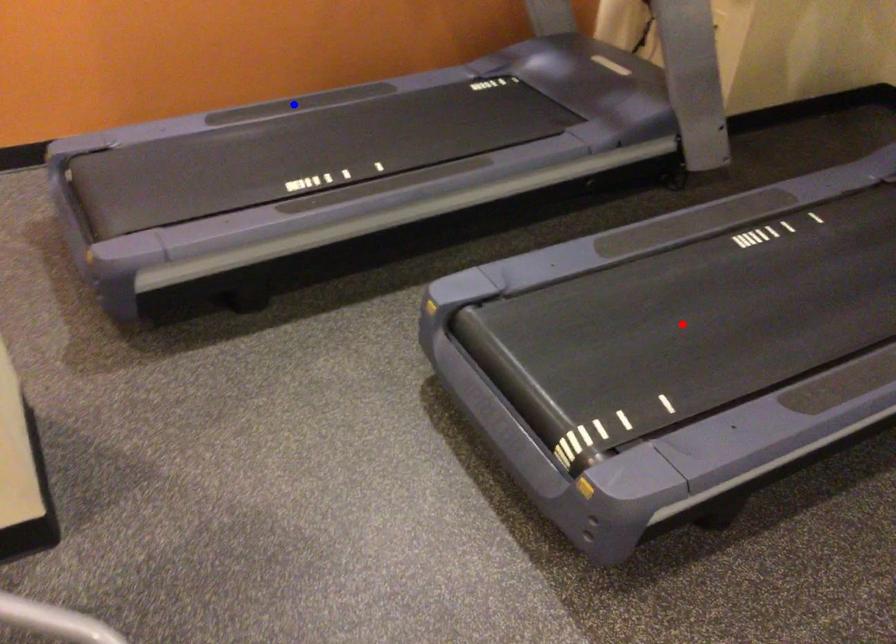
Question: Which of the two points in the image is closer to the camera?

Choices:
 (A) Blue point is closer.
 (B) Red point is closer.

Answer: (B)